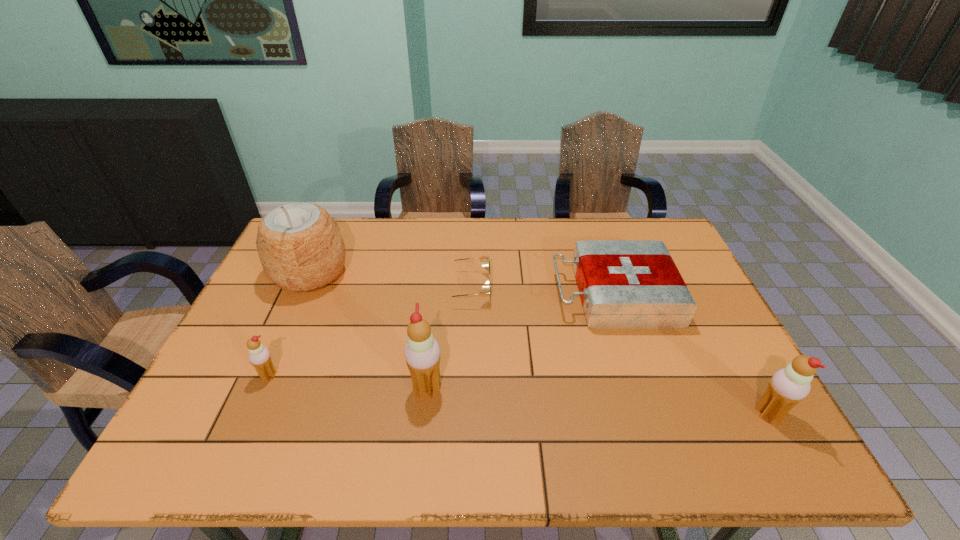
I want to click on coconut present at the left edge, so click(300, 246).

At what (x,y) coordinates should I click in order to perform the action: click on icecream that is at the right edge. Please return your answer as a coordinate pair (x, y). Looking at the image, I should click on (788, 386).

Where is `the first-aid kit at the right edge`? The width and height of the screenshot is (960, 540). the first-aid kit at the right edge is located at coordinates (624, 284).

The width and height of the screenshot is (960, 540). Identify the location of object that is at the far left corner. (300, 246).

Locate an element on the screen. object located at the near right corner is located at coordinates (788, 386).

Where is `free location at the far edge of the desktop`? free location at the far edge of the desktop is located at coordinates (375, 260).

I want to click on blank space at the left edge, so click(x=249, y=330).

Where is `free spot at the near left corner of the desktop`? free spot at the near left corner of the desktop is located at coordinates (250, 403).

This screenshot has width=960, height=540. What are the coordinates of `free location at the far right corner of the desktop` in the screenshot? It's located at (674, 259).

Image resolution: width=960 pixels, height=540 pixels. In order to click on vacant space at the near right corner of the desktop in this screenshot , I will do `click(756, 409)`.